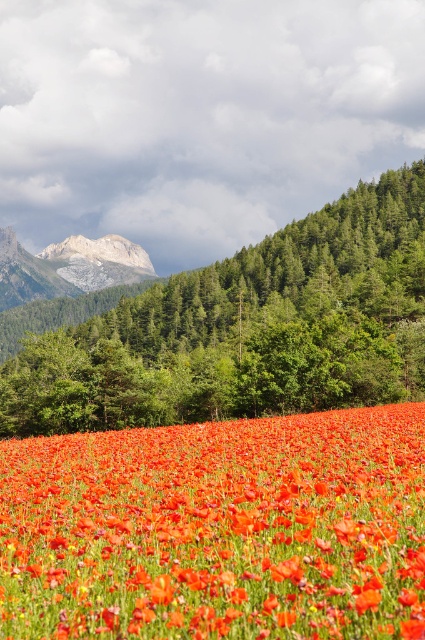
Question: Which object is closer to the camera taking this photo?

Choices:
 (A) gray rocky mountain at upper left
 (B) green leafy tree at center
 (C) bright red petals at center

Answer: (C)

Question: Is bright red petals at center thinner than green leafy tree at center?

Choices:
 (A) yes
 (B) no

Answer: (A)

Question: Considering the real-world distances, which object is closest to the bright red petals at center?

Choices:
 (A) gray rocky mountain at upper left
 (B) green leafy tree at center

Answer: (B)

Question: Can you confirm if bright red petals at center is bigger than green leafy tree at center?

Choices:
 (A) yes
 (B) no

Answer: (B)

Question: Which is nearer to the green leafy tree at center?

Choices:
 (A) gray rocky mountain at upper left
 (B) bright red petals at center

Answer: (B)

Question: Does bright red petals at center appear on the right side of green leafy tree at center?

Choices:
 (A) no
 (B) yes

Answer: (A)